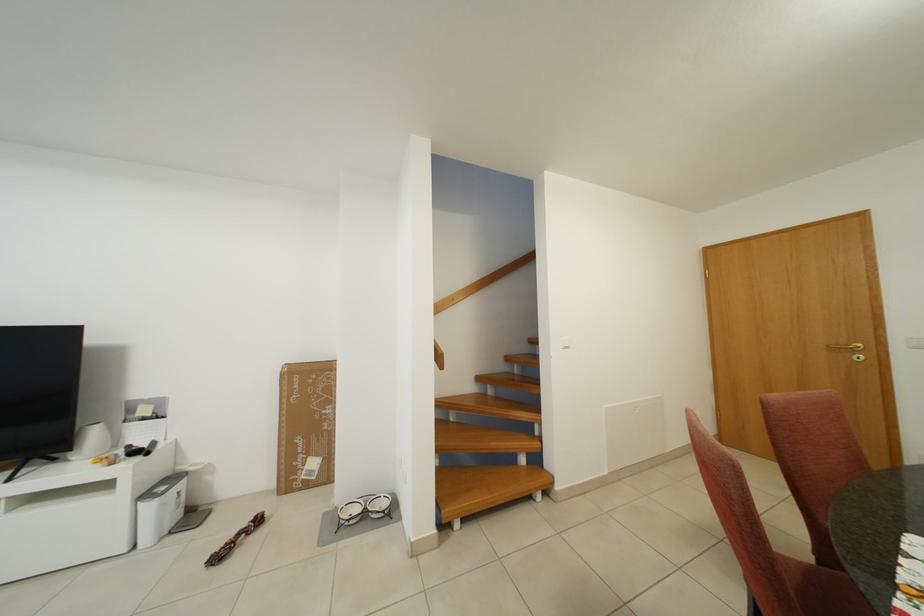
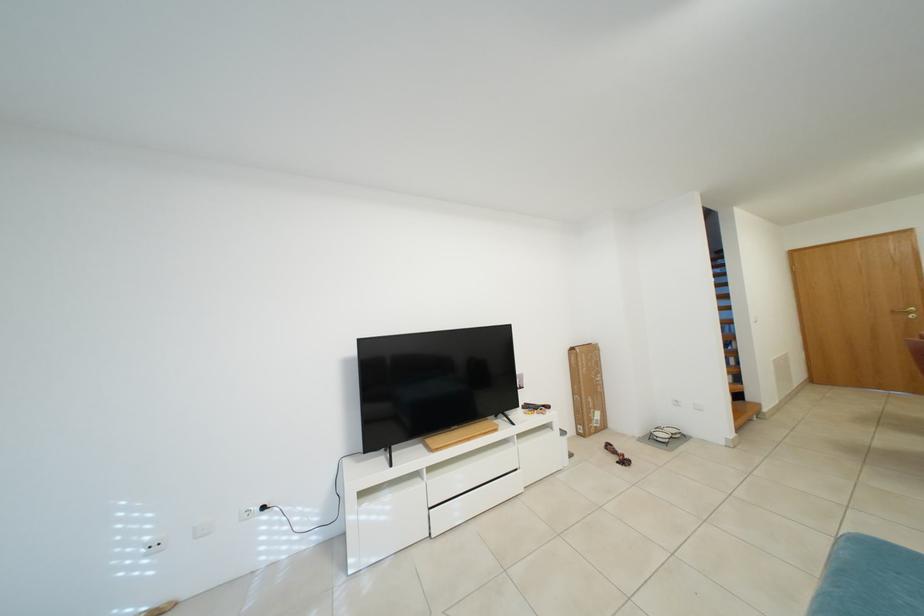
Question: The images are taken continuously from a first-person perspective. In which direction are you moving?

Choices:
 (A) Left
 (B) Right
 (C) Forward
 (D) Backward

Answer: (A)